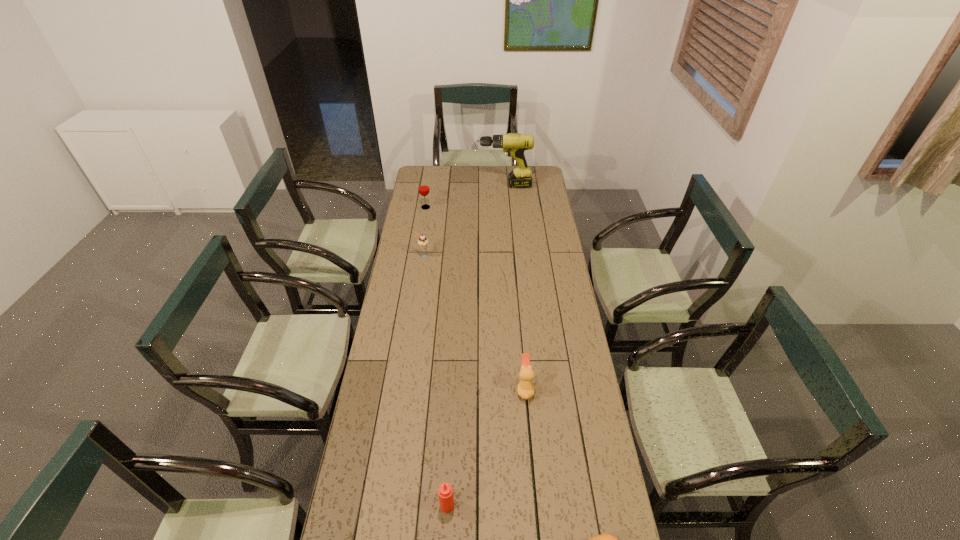
Where is `free spot located on the handle side of the tallest object`? The width and height of the screenshot is (960, 540). free spot located on the handle side of the tallest object is located at coordinates (460, 186).

What are the coordinates of `vacant region located 0.400m on the right of the fifth nearest object` in the screenshot? It's located at (505, 207).

Where is `free region located 0.170m on the right of the icecream`? The width and height of the screenshot is (960, 540). free region located 0.170m on the right of the icecream is located at coordinates (467, 256).

Where is `free space located on the back of the Tabasco sauce`? This screenshot has width=960, height=540. free space located on the back of the Tabasco sauce is located at coordinates (449, 457).

Find the location of `vacant area situated 0.400m on the beak of the second shortest object`. vacant area situated 0.400m on the beak of the second shortest object is located at coordinates (403, 389).

Locate an element on the screen. The image size is (960, 540). free space located on the beak of the second shortest object is located at coordinates (454, 389).

The height and width of the screenshot is (540, 960). Identify the location of vacant space situated 0.380m on the beak of the second shortest object. (409, 389).

You are a GUI agent. You are given a task and a screenshot of the screen. Output one action in this format:
    pyautogui.click(x=<x>, y=<y>)
    Task: Click on the object that is at the far edge
    This screenshot has height=540, width=960.
    Given the screenshot: What is the action you would take?
    pyautogui.click(x=515, y=144)

Locate an element on the screen. Image resolution: width=960 pixels, height=540 pixels. glass that is at the left edge is located at coordinates (423, 187).

The width and height of the screenshot is (960, 540). I want to click on icecream that is positioned at the left edge, so click(x=422, y=241).